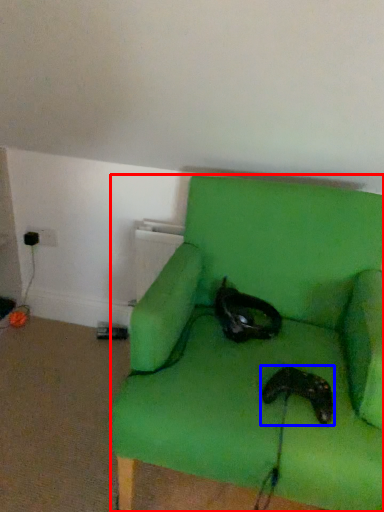
Question: Which of the following is the farthest to the observer, chair (highlighted by a red box) or footwear (highlighted by a blue box)?

Choices:
 (A) chair
 (B) footwear

Answer: (B)